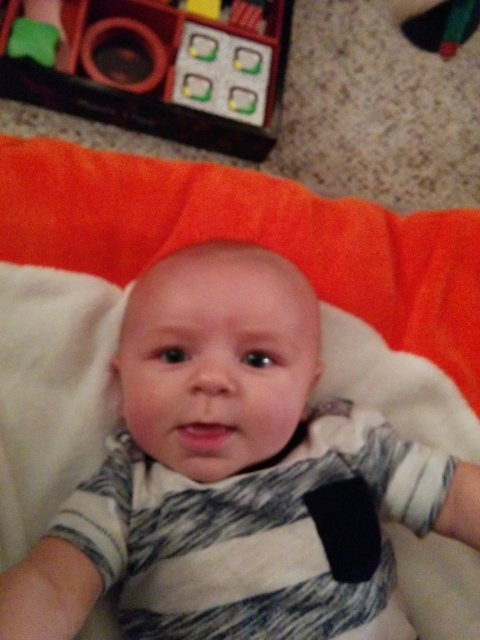
Question: Which of the following is the closest to the observer?

Choices:
 (A) (92, 381)
 (B) (96, 116)

Answer: (A)

Question: Is white soft baby at center to the left of matte plastic toy at upper left from the viewer's perspective?

Choices:
 (A) yes
 (B) no

Answer: (B)

Question: Does white soft baby at center lie behind matte plastic toy at upper left?

Choices:
 (A) no
 (B) yes

Answer: (A)

Question: Is white soft baby at center wider than matte plastic toy at upper left?

Choices:
 (A) yes
 (B) no

Answer: (B)